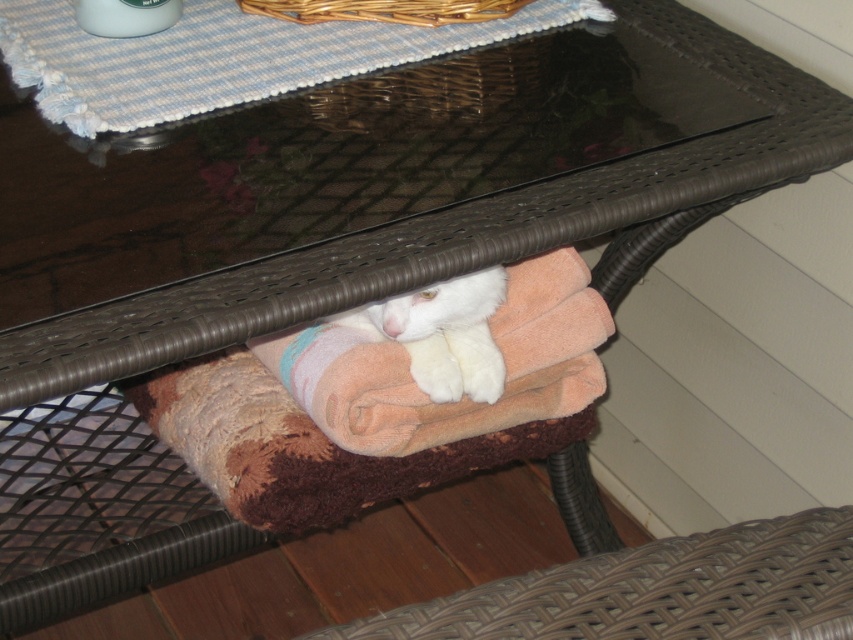
You are a guest at this patio and want to place a small potted plant between the white fluffy cat under the table and the woven wicker basket at upper center. Based on their heights, which object should the plant be placed closer to?

The white fluffy cat under the table is much taller than the woven wicker basket at upper center, so the plant should be placed closer to the woven wicker basket at upper center to ensure stability and visibility.

Looking at this image, you are a small toy that is 10 cm tall. You want to hide under the table where the soft pink towel at under table and the woven wicker basket at upper center are located. Which object should you hide behind to stay hidden from someone looking from above?

The soft pink towel at under table has a greater height compared to the woven wicker basket at upper center. Therefore, hiding behind the soft pink towel at under table would provide better coverage from above.

You are a guest sitting at the table and want to pet the white fluffy cat under the table. Which direction should you reach to find the cat relative to the blue woven placemat at upper center?

The white fluffy cat under the table is to the right of the blue woven placemat at upper center, so you should reach to the right side of the blue woven placemat at upper center to find the cat.